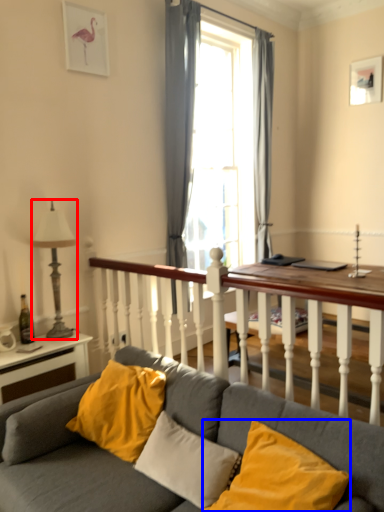
Question: Which object appears closest to the camera in this image, lamp (highlighted by a red box) or pillow (highlighted by a blue box)?

Choices:
 (A) lamp
 (B) pillow

Answer: (B)